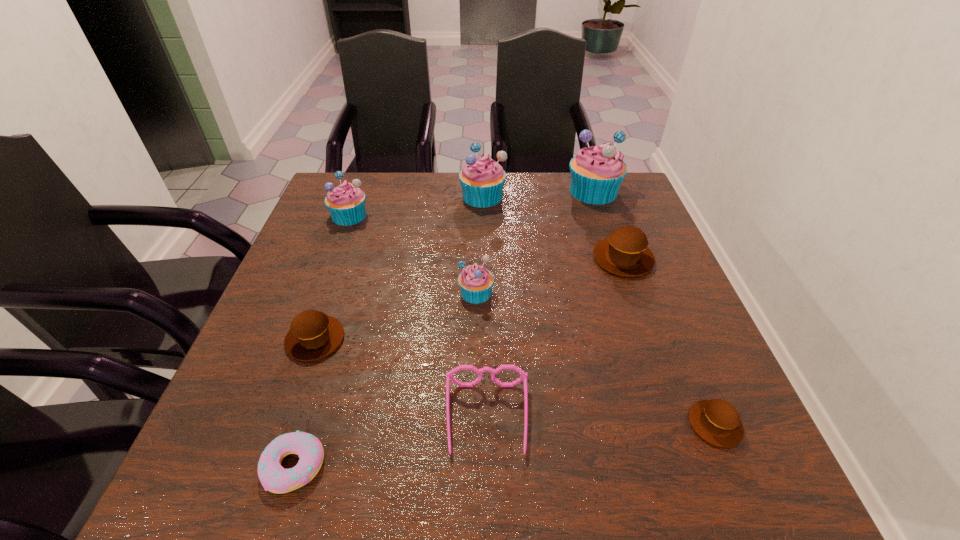
Identify the location of the fourth nearest object. The image size is (960, 540). (313, 335).

What are the coordinates of `the sixth tallest muffin` in the screenshot? It's located at (313, 335).

This screenshot has height=540, width=960. I want to click on pink spectacles, so click(523, 376).

This screenshot has width=960, height=540. Find the location of `the nearest brown muffin`. the nearest brown muffin is located at coordinates (716, 421).

The width and height of the screenshot is (960, 540). In order to click on the shortest muffin in this screenshot , I will do `click(716, 421)`.

In order to click on doughnut in this screenshot , I will do `click(274, 478)`.

Identify the location of free space located on the left of the biggest blue muffin. The width and height of the screenshot is (960, 540). pyautogui.click(x=519, y=191).

Locate an element on the screen. vacant space located on the right of the second tallest object is located at coordinates (620, 196).

This screenshot has width=960, height=540. What are the coordinates of `vacant area situated on the right of the third biggest blue muffin` in the screenshot? It's located at (437, 215).

This screenshot has height=540, width=960. Identify the location of vacant region located on the back of the fifth nearest object. (477, 206).